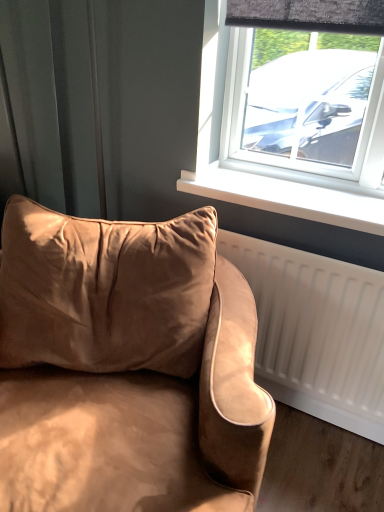
Question: Can you confirm if suede-like beige couch at lower left is positioned to the right of white plastic window sill at center?

Choices:
 (A) no
 (B) yes

Answer: (A)

Question: From the image's perspective, is suede-like beige couch at lower left over white plastic window sill at center?

Choices:
 (A) yes
 (B) no

Answer: (B)

Question: Is suede-like beige couch at lower left facing away from white plastic window sill at center?

Choices:
 (A) no
 (B) yes

Answer: (B)

Question: From a real-world perspective, is suede-like beige couch at lower left over white plastic window sill at center?

Choices:
 (A) yes
 (B) no

Answer: (B)

Question: Is suede-like beige couch at lower left closer to the viewer compared to white plastic window sill at center?

Choices:
 (A) no
 (B) yes

Answer: (B)

Question: Is suede-like beige couch at lower left facing towards white plastic window sill at center?

Choices:
 (A) yes
 (B) no

Answer: (B)

Question: Is white plastic window sill at center positioned before suede-like beige couch at lower left?

Choices:
 (A) yes
 (B) no

Answer: (B)

Question: Is the surface of white plastic window sill at center in direct contact with suede-like beige couch at lower left?

Choices:
 (A) yes
 (B) no

Answer: (B)

Question: Can you confirm if white plastic window sill at center is smaller than suede-like beige couch at lower left?

Choices:
 (A) yes
 (B) no

Answer: (A)

Question: Is white plastic window sill at center further to the viewer compared to suede-like beige couch at lower left?

Choices:
 (A) yes
 (B) no

Answer: (A)

Question: Could you tell me if white plastic window sill at center is facing suede-like beige couch at lower left?

Choices:
 (A) yes
 (B) no

Answer: (A)

Question: Considering the relative sizes of white plastic window sill at center and suede-like beige couch at lower left in the image provided, is white plastic window sill at center thinner than suede-like beige couch at lower left?

Choices:
 (A) yes
 (B) no

Answer: (A)

Question: Do you think suede-like beige couch at lower left is within white plastic window sill at center, or outside of it?

Choices:
 (A) inside
 (B) outside

Answer: (B)